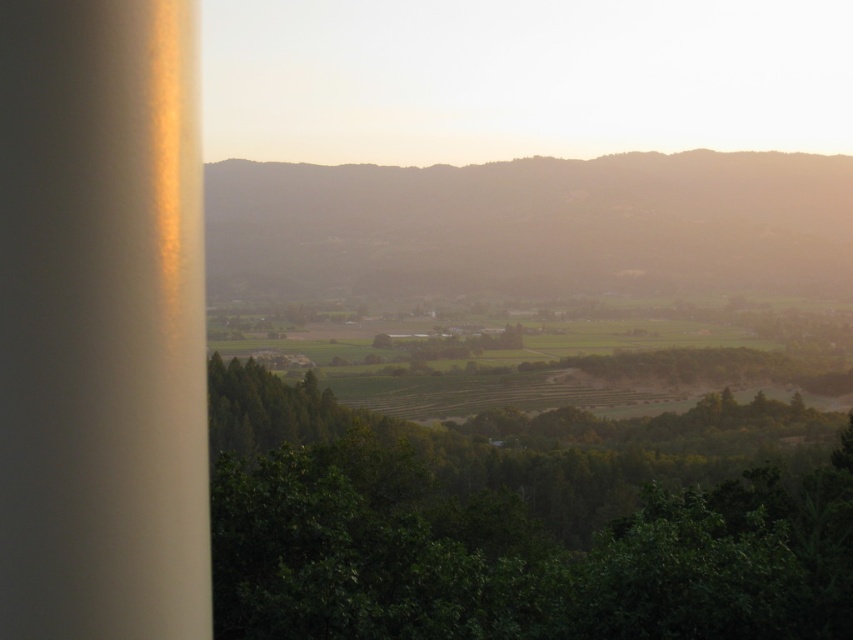
You are an environmental planner assessing land use. You see the green leafy tree at center and the green grassy hillside at center. Which of these two has a smaller width?

The green leafy tree at center is thinner than the green grassy hillside at center, so the green leafy tree at center has a smaller width.